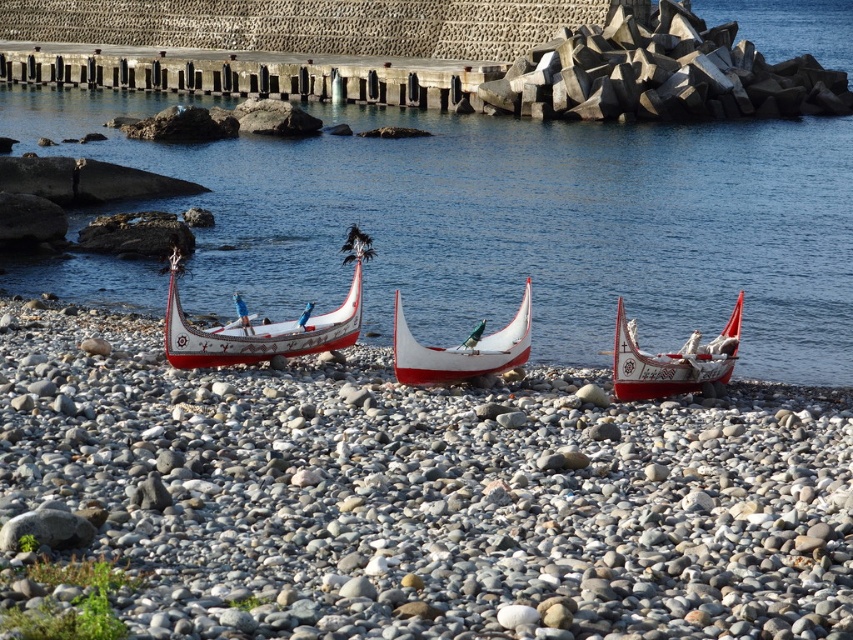
You are a photographer planning to take a wide shot of the scene. You want to ensure that both the transparent water at center and the concrete pier at upper center are fully visible in the frame. Based on their sizes, which object will require more space in the composition?

The transparent water at center requires more space in the composition because its width is larger than the concrete pier at upper center.

You are standing at the edge of the beach looking at the canoes. There are two points marked on the image. Which point is closer to you, point (260, 324) or point (465, 374)?

Point (465, 374) is closer to you because point (260, 324) is further away from the camera.

Looking at this image, you are standing at the origin point in the coastal scene. There are two points marked in the image, point A at point (351, 86) and point B at point (525, 349). If you want to reach point A first before point B, which direction should you move first from your current position?

Since point A at point (351, 86) is behind point B at point (525, 349), you should move in the direction away from point B to reach point A first before point B.